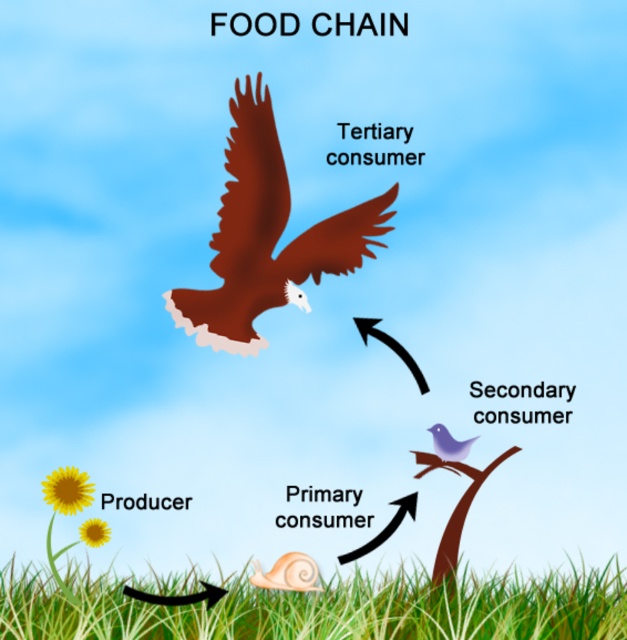
Locate an element on the screen. The width and height of the screenshot is (627, 640). green grass at lower center is located at coordinates (325, 605).

Between point (65, 621) and point (245, 154), which one is positioned behind?

Positioned behind is point (245, 154).

At what (x,y) coordinates should I click in order to perform the action: click on green grass at lower center. Please return your answer as a coordinate pair (x, y). The width and height of the screenshot is (627, 640). Looking at the image, I should click on (325, 605).

Can you confirm if green grass at lower center is positioned below purple matte bird at upper center?

Yes.

Does point (514, 627) come behind point (446, 449)?

No.

Identify the location of green grass at lower center. (325, 605).

Is brown matte eagle at upper center below purple matte bird at upper center?

Incorrect, brown matte eagle at upper center is not positioned below purple matte bird at upper center.

Is point (275, 195) more distant than point (461, 449)?

No, it is not.

Locate an element on the screen. This screenshot has width=627, height=640. brown matte eagle at upper center is located at coordinates click(266, 236).